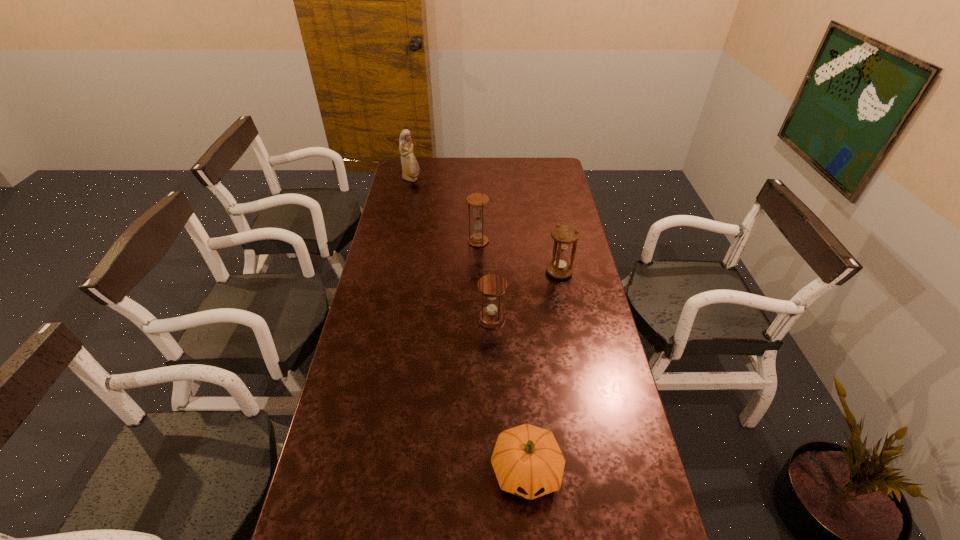
Where is `free space between the second nearest object and the gourd`? This screenshot has height=540, width=960. free space between the second nearest object and the gourd is located at coordinates click(509, 395).

Identify the location of vacant area that lies between the tallest object and the rightmost hourglass. click(486, 226).

Locate an element on the screen. free space between the tallest object and the rightmost object is located at coordinates (486, 226).

The image size is (960, 540). In order to click on blank region between the fourth nearest object and the figurine in this screenshot , I will do `click(444, 211)`.

Locate an element on the screen. vacant space in between the third nearest object and the fourth nearest object is located at coordinates (518, 256).

The image size is (960, 540). I want to click on vacant space that is in between the fourth farthest object and the rightmost hourglass, so pos(525,295).

Locate an element on the screen. This screenshot has width=960, height=540. free space between the gourd and the farthest hourglass is located at coordinates (502, 356).

Locate an element on the screen. This screenshot has width=960, height=540. unoccupied area between the shortest hourglass and the second nearest hourglass is located at coordinates (525, 295).

Where is `free space that is in between the tallest object and the fourth nearest object`? This screenshot has height=540, width=960. free space that is in between the tallest object and the fourth nearest object is located at coordinates 444,211.

You are a GUI agent. You are given a task and a screenshot of the screen. Output one action in this format:
    pyautogui.click(x=<x>, y=<y>)
    Task: Click on the object that is the third nearest to the gourd
    
    Given the screenshot: What is the action you would take?
    pyautogui.click(x=477, y=200)